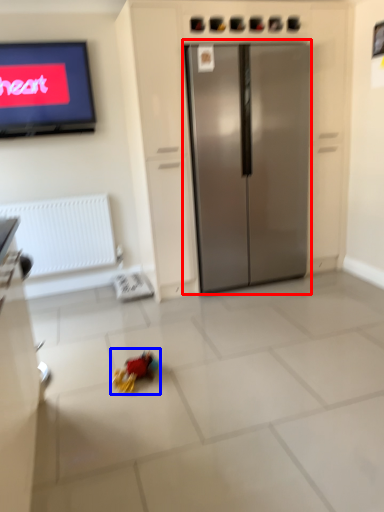
Question: Which object appears closest to the camera in this image, refrigerator (highlighted by a red box) or miniature (highlighted by a blue box)?

Choices:
 (A) refrigerator
 (B) miniature

Answer: (B)